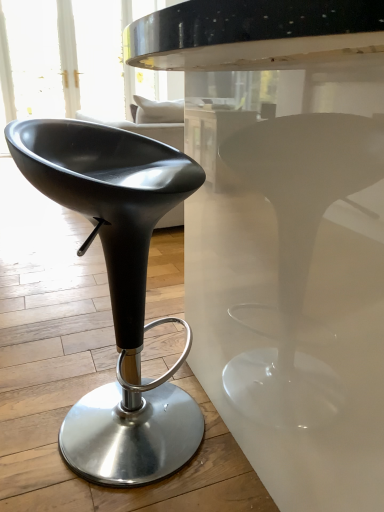
Question: Should I look upward or downward to see matte black stool at left?

Choices:
 (A) down
 (B) up

Answer: (A)